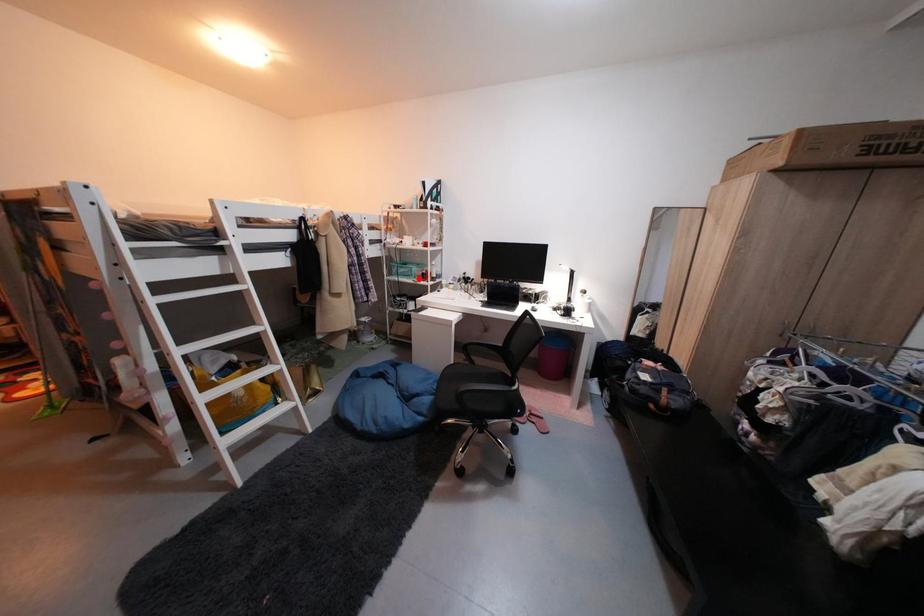
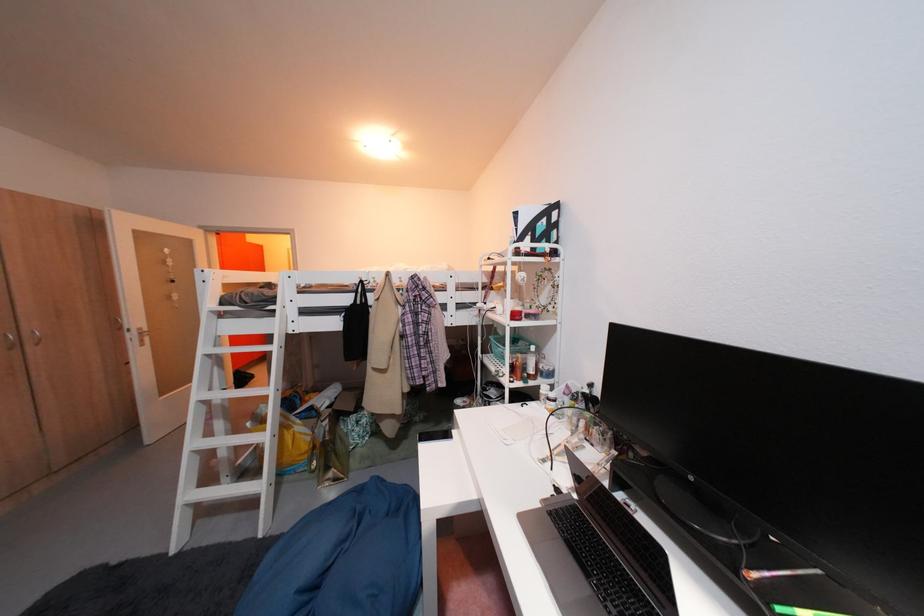
The point at the highlighted location is marked in the first image. Where is the corresponding point in the second image?

(514, 363)